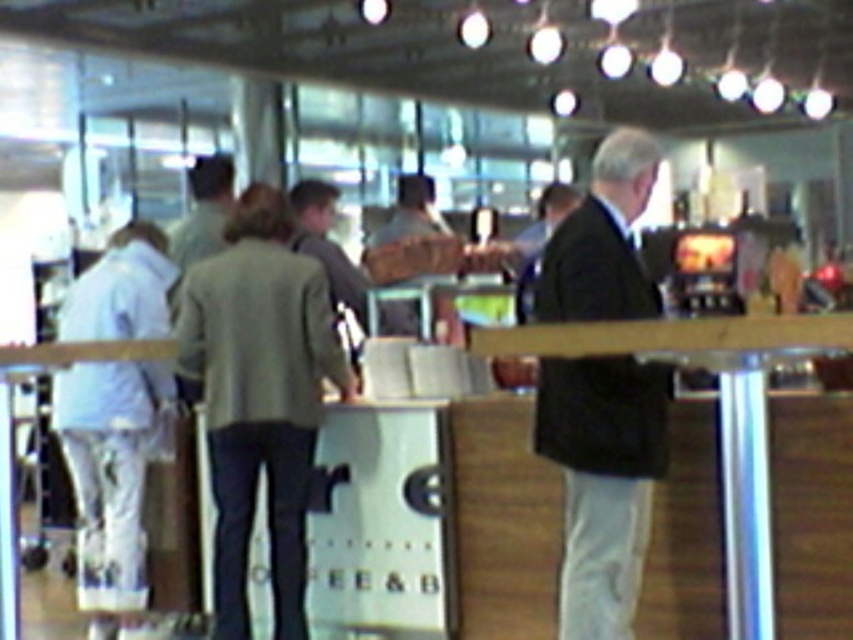
Question: Where is green wool jacket at center located in relation to dark suit jacket at center in the image?

Choices:
 (A) left
 (B) right

Answer: (A)

Question: Which of these objects is positioned closest to the dark suit jacket at center?

Choices:
 (A) green wool jacket at center
 (B) white fabric pants at left

Answer: (A)

Question: Which of the following is the farthest from the observer?

Choices:
 (A) tap(138, 381)
 (B) tap(635, 506)

Answer: (A)

Question: Can you confirm if green wool jacket at center is wider than white fabric pants at left?

Choices:
 (A) yes
 (B) no

Answer: (A)

Question: Which of these objects is positioned closest to the white fabric pants at left?

Choices:
 (A) green wool jacket at center
 (B) dark suit jacket at center

Answer: (A)

Question: Is dark suit jacket at center thinner than white fabric pants at left?

Choices:
 (A) yes
 (B) no

Answer: (A)